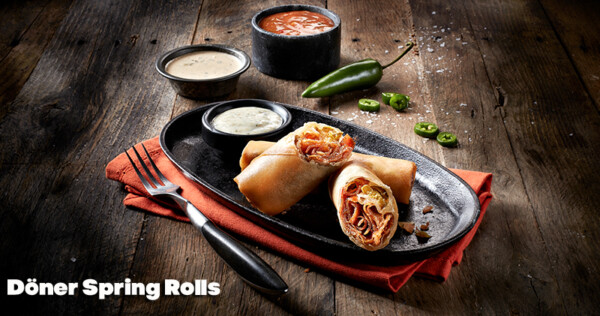
I want to click on wooden table, so click(97, 223).